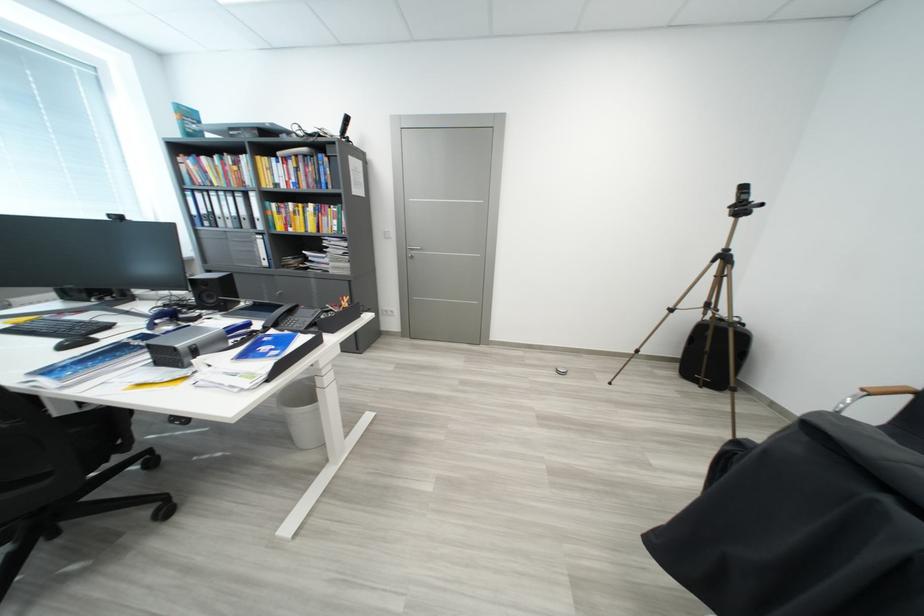
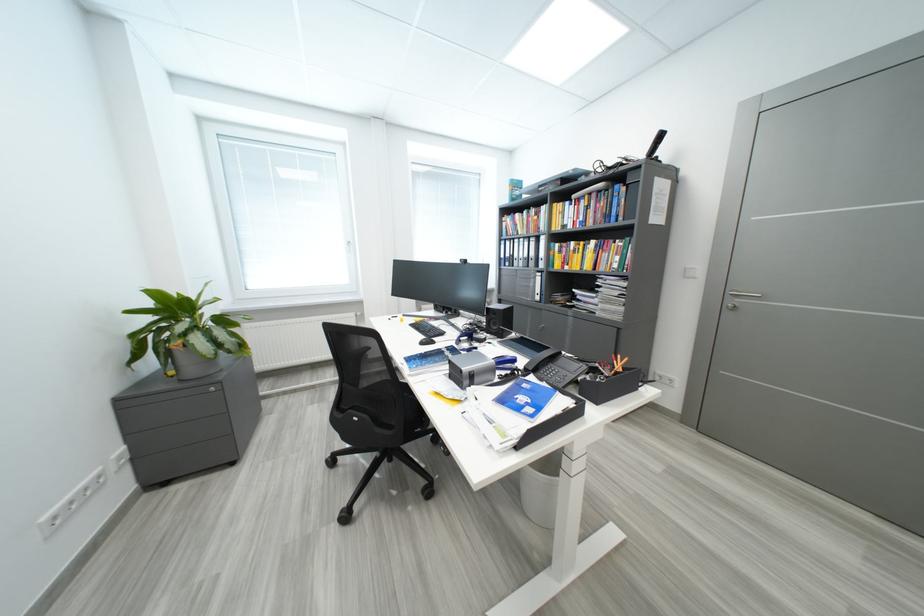
Find the pixel in the second image that matches (67,342) in the first image.

(431, 341)